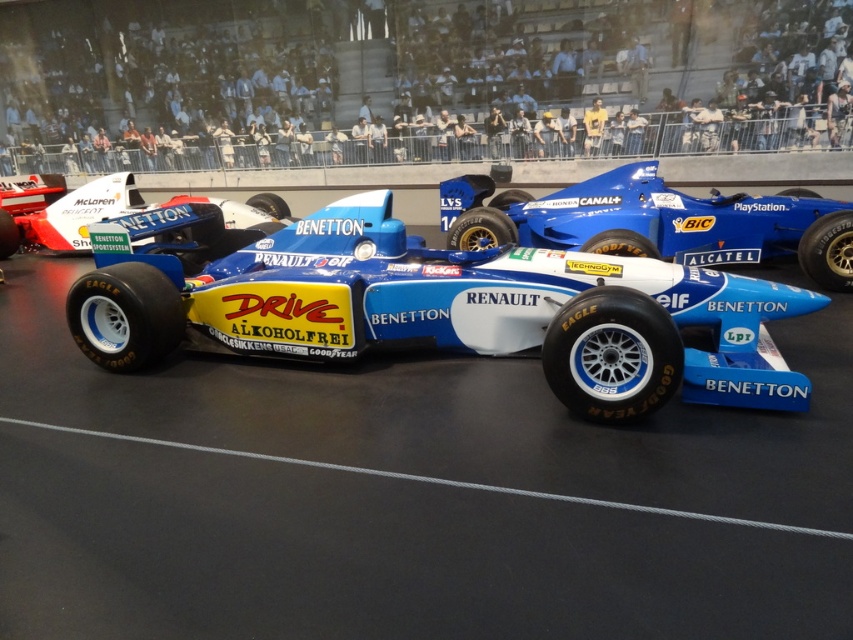
In the scene shown: Can you confirm if blue matte race car at center is thinner than matte white race car at center?

No, blue matte race car at center is not thinner than matte white race car at center.

Does blue matte race car at center have a greater height compared to matte white race car at center?

No, blue matte race car at center is not taller than matte white race car at center.

Find the location of a particular element. blue matte race car at center is located at coordinates pos(654,221).

This screenshot has width=853, height=640. I want to click on blue matte race car at center, so click(x=654, y=221).

Which of these two, blue rubber race track at center or blue matte race car at center, stands taller?

Standing taller between the two is blue matte race car at center.

Which is in front, point (779, 454) or point (711, 224)?

Point (779, 454) is more forward.

Measure the distance between point (402,458) and camera.

A distance of 2.44 meters exists between point (402,458) and camera.

At what (x,y) coordinates should I click in order to perform the action: click on blue rubber race track at center. Please return your answer as a coordinate pair (x, y). Looking at the image, I should click on (419, 412).

Is point (537, 390) closer to camera compared to point (90, 186)?

Yes, it is in front of point (90, 186).

Between blue rubber race track at center and matte white race car at center, which one is positioned higher?

Positioned higher is matte white race car at center.

Identify the location of blue rubber race track at center. This screenshot has height=640, width=853. click(419, 412).